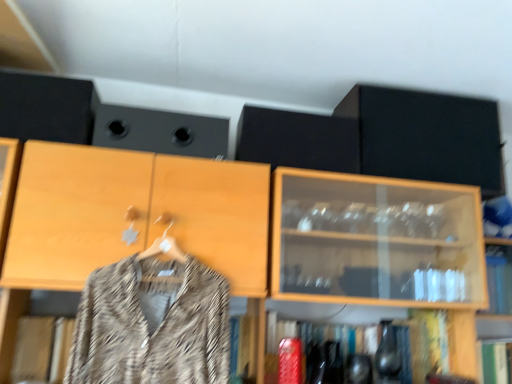
The width and height of the screenshot is (512, 384). What do you see at coordinates (440, 343) in the screenshot?
I see `shiny metallic vase at lower center` at bounding box center [440, 343].

The width and height of the screenshot is (512, 384). What are the coordinates of `black matte speaker at upper center, which is the second speaker in right-to-left order` in the screenshot? It's located at (160, 131).

At what (x,y) coordinates should I click in order to perform the action: click on black matte cabinet at upper right. Please return your answer as a coordinate pair (x, y). The width and height of the screenshot is (512, 384). Looking at the image, I should click on (426, 136).

Find the location of a particular element. The width and height of the screenshot is (512, 384). shiny metallic vase at lower center is located at coordinates (440, 343).

From the image's perspective, is shiny metallic vase at lower center above black matte cabinet at upper right?

No, from the image's perspective, shiny metallic vase at lower center is not over black matte cabinet at upper right.

From a real-world perspective, between shiny metallic vase at lower center and black matte cabinet at upper right, who is vertically higher?

In real-world perspective, black matte cabinet at upper right is above.

Is shiny metallic vase at lower center turned away from black matte cabinet at upper right?

shiny metallic vase at lower center does not have its back to black matte cabinet at upper right.

Identify the location of cabinetry above the shiny metallic vase at lower center (from a real-world perspective). (426, 136).

Is shiny metallic vase at lower center positioned with its back to patterned fabric coat at center?

That's not correct — shiny metallic vase at lower center is not looking away from patterned fabric coat at center.

From the picture: From a real-world perspective, is shiny metallic vase at lower center physically located above or below patterned fabric coat at center?

shiny metallic vase at lower center is situated lower than patterned fabric coat at center in the real world.

Which object is positioned more to the right, shiny metallic vase at lower center or patterned fabric coat at center?

shiny metallic vase at lower center.

Who is bigger, shiny metallic vase at lower center or patterned fabric coat at center?

Bigger between the two is patterned fabric coat at center.

From a real-world perspective, relative to black matte speaker at upper center, which is the first speaker from left to right, is patterned fabric coat at center vertically above or below?

Clearly, from a real-world perspective, patterned fabric coat at center is below black matte speaker at upper center, which is the first speaker from left to right.

Considering the sizes of objects patterned fabric coat at center and black matte speaker at upper center, which is the second speaker in right-to-left order, in the image provided, who is thinner, patterned fabric coat at center or black matte speaker at upper center, which is the second speaker in right-to-left order,?

Thinner between the two is black matte speaker at upper center, which is the second speaker in right-to-left order.

How many degrees apart are the facing directions of patterned fabric coat at center and black matte speaker at upper center, which is the second speaker in right-to-left order?

There is a 0.000698-degree angle between the facing directions of patterned fabric coat at center and black matte speaker at upper center, which is the second speaker in right-to-left order.

Is patterned fabric coat at center oriented towards black matte speaker at upper center, which is the second speaker in right-to-left order?

No, patterned fabric coat at center is not facing towards black matte speaker at upper center, which is the second speaker in right-to-left order.

Choose the correct answer: Is black matte speaker at upper center, which appears as the 2th speaker when viewed from the left, inside patterned fabric coat at center or outside it?

black matte speaker at upper center, which appears as the 2th speaker when viewed from the left, lies outside patterned fabric coat at center.

From a real-world perspective, which object rests below the other?

patterned fabric coat at center.

Does black matte speaker at upper center, positioned as the first speaker in right-to-left order, touch patterned fabric coat at center?

black matte speaker at upper center, positioned as the first speaker in right-to-left order, and patterned fabric coat at center are not in contact.

Looking at the image, does black matte speaker at upper center, which is the first speaker from left to right, seem bigger or smaller compared to patterned fabric coat at center?

In the image, black matte speaker at upper center, which is the first speaker from left to right, appears to be smaller than patterned fabric coat at center.

Considering the relative sizes of black matte speaker at upper center, which is the first speaker from left to right, and patterned fabric coat at center in the image provided, is black matte speaker at upper center, which is the first speaker from left to right, taller than patterned fabric coat at center?

In fact, black matte speaker at upper center, which is the first speaker from left to right, may be shorter than patterned fabric coat at center.

Considering the relative sizes of black matte speaker at upper center, which is the second speaker in right-to-left order, and patterned fabric coat at center in the image provided, is black matte speaker at upper center, which is the second speaker in right-to-left order, wider than patterned fabric coat at center?

In fact, black matte speaker at upper center, which is the second speaker in right-to-left order, might be narrower than patterned fabric coat at center.

Would you say black matte speaker at upper center, which is the second speaker in right-to-left order, is inside or outside patterned fabric coat at center?

The correct answer is: outside.

Find the location of `speaker located behind the shiny metallic vase at lower center`. speaker located behind the shiny metallic vase at lower center is located at coordinates (298, 140).

Are shiny metallic vase at lower center and black matte speaker at upper center, which appears as the 2th speaker when viewed from the left, beside each other?

No, shiny metallic vase at lower center is not making contact with black matte speaker at upper center, which appears as the 2th speaker when viewed from the left.

Considering the positions of points (420, 378) and (268, 131), is point (420, 378) farther from camera compared to point (268, 131)?

Yes, it is behind point (268, 131).

What's the angular difference between shiny metallic vase at lower center and black matte speaker at upper center, positioned as the first speaker in right-to-left order,'s facing directions?

The angular difference between shiny metallic vase at lower center and black matte speaker at upper center, positioned as the first speaker in right-to-left order, is 1.19 degrees.

In the scene shown: Is shiny metallic vase at lower center outside of black matte speaker at upper center, which is the first speaker from left to right?

shiny metallic vase at lower center is positioned outside black matte speaker at upper center, which is the first speaker from left to right.

Is shiny metallic vase at lower center bigger or smaller than black matte speaker at upper center, which is the second speaker in right-to-left order?

Considering their sizes, shiny metallic vase at lower center takes up more space than black matte speaker at upper center, which is the second speaker in right-to-left order.

Which of these two, shiny metallic vase at lower center or black matte speaker at upper center, which is the second speaker in right-to-left order, stands shorter?

Standing shorter between the two is black matte speaker at upper center, which is the second speaker in right-to-left order.

Does shiny metallic vase at lower center have a lesser width compared to black matte speaker at upper center, which is the first speaker from left to right?

No, shiny metallic vase at lower center is not thinner than black matte speaker at upper center, which is the first speaker from left to right.

Locate an element on the screen. The image size is (512, 384). shelf in front of the black matte cabinet at upper right is located at coordinates (440, 343).

Image resolution: width=512 pixels, height=384 pixels. Identify the location of clothing located on the left of shiny metallic vase at lower center. (152, 324).

Looking at the image, which one is located closer to black matte speaker at upper center, positioned as the first speaker in right-to-left order, patterned fabric coat at center or shiny metallic vase at lower center?

The object closer to black matte speaker at upper center, positioned as the first speaker in right-to-left order, is patterned fabric coat at center.

Which object lies nearer to the anchor point patterned fabric coat at center, black matte speaker at upper center, which appears as the 2th speaker when viewed from the left, or shiny metallic vase at lower center?

shiny metallic vase at lower center lies closer to patterned fabric coat at center than the other object.

When comparing their distances from black matte cabinet at upper right, does shiny metallic vase at lower center or black matte speaker at upper center, positioned as the first speaker in right-to-left order, seem further?

shiny metallic vase at lower center is positioned further to the anchor black matte cabinet at upper right.

Estimate the real-world distances between objects in this image. Which object is closer to black matte cabinet at upper right, shiny metallic vase at lower center or patterned fabric coat at center?

shiny metallic vase at lower center.

Which object lies nearer to the anchor point black matte speaker at upper center, which appears as the 2th speaker when viewed from the left, shiny metallic vase at lower center or patterned fabric coat at center?

patterned fabric coat at center is positioned closer to the anchor black matte speaker at upper center, which appears as the 2th speaker when viewed from the left.

When comparing their distances from patterned fabric coat at center, does black matte speaker at upper center, which is the first speaker from left to right, or black matte speaker at upper center, which appears as the 2th speaker when viewed from the left, seem closer?

black matte speaker at upper center, which is the first speaker from left to right, lies closer to patterned fabric coat at center than the other object.

Estimate the real-world distances between objects in this image. Which object is closer to black matte speaker at upper center, which is the second speaker in right-to-left order, black matte speaker at upper center, which appears as the 2th speaker when viewed from the left, or patterned fabric coat at center?

black matte speaker at upper center, which appears as the 2th speaker when viewed from the left, lies closer to black matte speaker at upper center, which is the second speaker in right-to-left order, than the other object.

When comparing their distances from shiny metallic vase at lower center, does black matte speaker at upper center, positioned as the first speaker in right-to-left order, or black matte cabinet at upper right seem closer?

Based on the image, black matte cabinet at upper right appears to be nearer to shiny metallic vase at lower center.

Find the location of a particular element. shelf located between black matte speaker at upper center, which is the second speaker in right-to-left order, and black matte cabinet at upper right in the left-right direction is located at coordinates (440, 343).

The image size is (512, 384). I want to click on clothing between black matte speaker at upper center, which is the first speaker from left to right, and black matte cabinet at upper right from left to right, so click(x=152, y=324).

At what (x,y) coordinates should I click in order to perform the action: click on speaker situated between patterned fabric coat at center and black matte cabinet at upper right from left to right. Please return your answer as a coordinate pair (x, y). This screenshot has height=384, width=512. Looking at the image, I should click on (298, 140).

At what (x,y) coordinates should I click in order to perform the action: click on speaker between black matte speaker at upper center, which is the second speaker in right-to-left order, and patterned fabric coat at center, in the vertical direction. Please return your answer as a coordinate pair (x, y). This screenshot has height=384, width=512. Looking at the image, I should click on (298, 140).